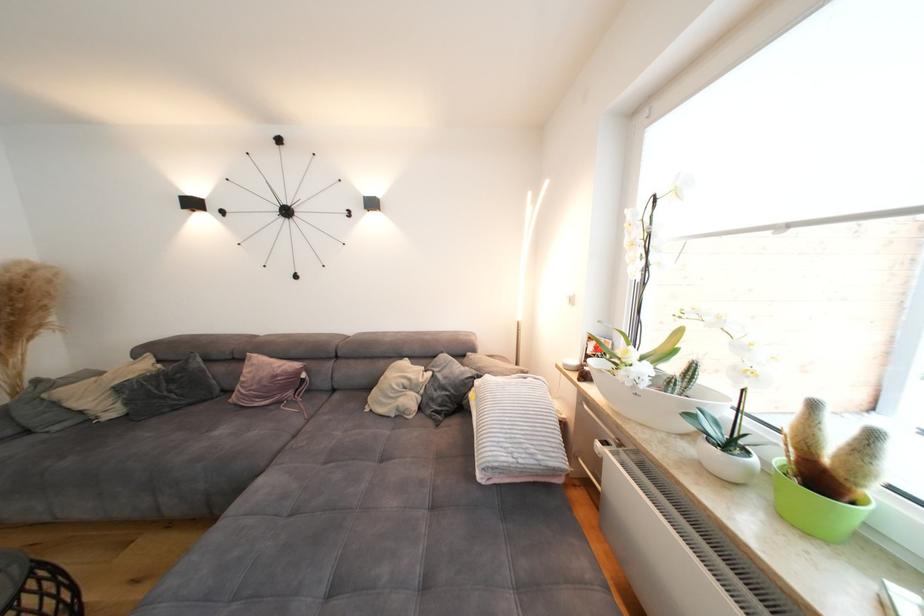
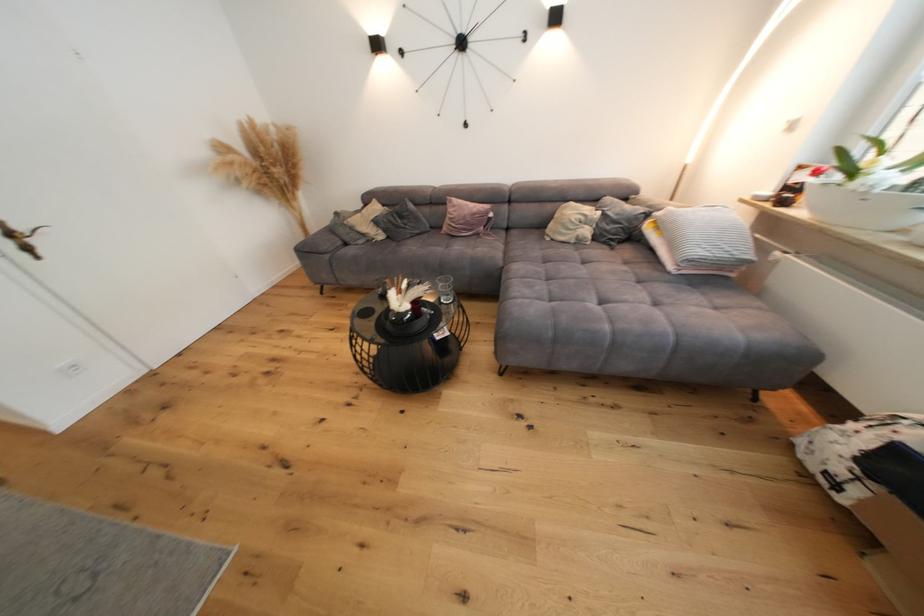
Find the pixel in the second image that matches point 41,424 in the first image.

(354, 240)